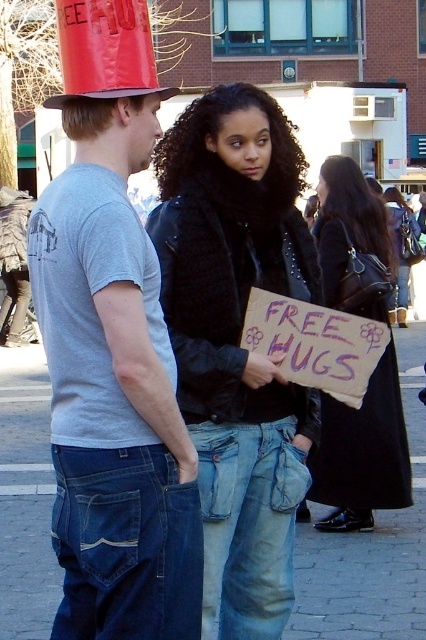
You are a pedestrian walking down the street and see the blue jeans at center and the shiny red paper hat at upper left. Which object is closer to you?

The blue jeans at center is closer to you because the shiny red paper hat at upper left is behind it.